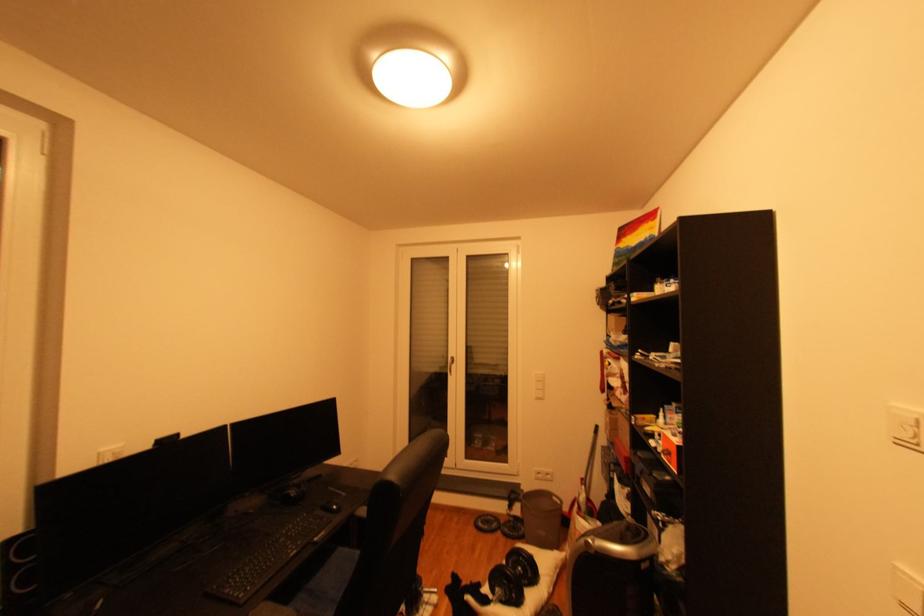
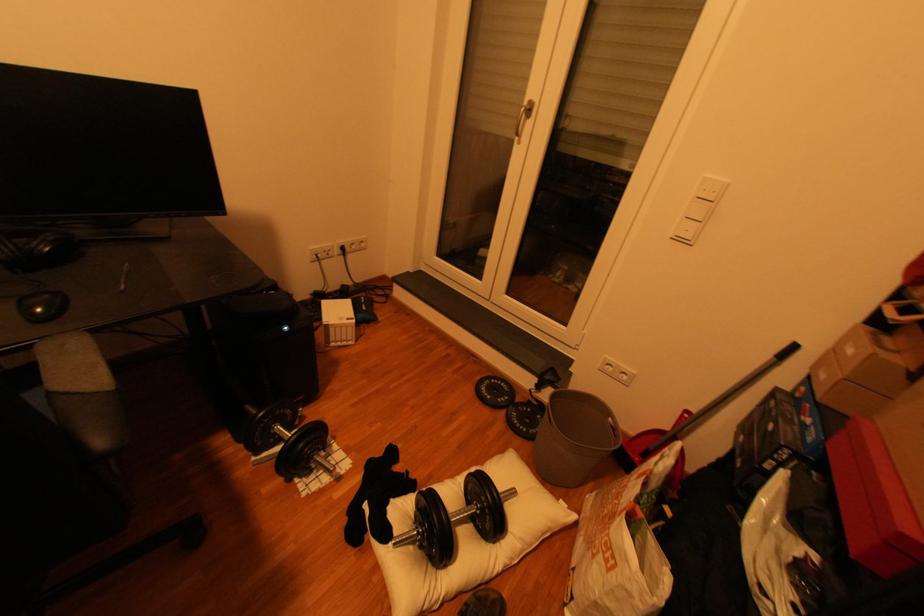
Locate, in the second image, the point that corresponds to the point at 546,399 in the first image.

(687, 240)